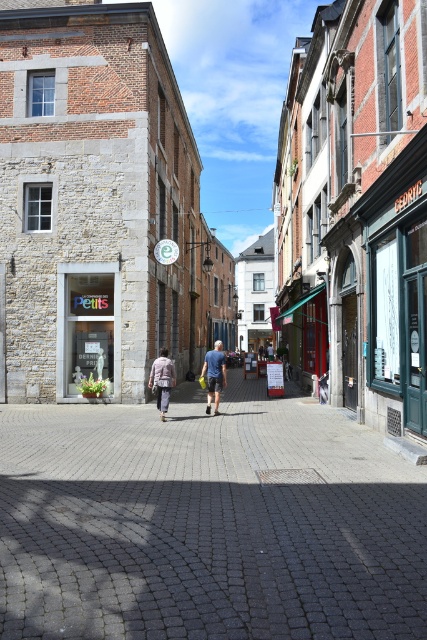
You are standing on a cobblestone street in a European town. You see a green fabric awning at center. Where exactly is the green fabric awning located in relation to the point marked at coordinates [307,336]?

The green fabric awning at center is located exactly at the point marked at coordinates [307,336].

You are a delivery person trying to place a box on the ground in this urban street scene. The box is 5 cm tall. You have two options to place it on either the gray cobblestone pavement at center or the matte glass storefront at center. Which surface can safely accommodate the box without it being unstable due to height differences?

The gray cobblestone pavement at center has a lesser height compared to the matte glass storefront at center, so placing the box on the gray cobblestone pavement at center would be safer as it is lower and more stable.

You are a delivery person standing at the entrance of the building on the left. You need to place a package at the green fabric awning at center and then deliver another package to the light brown fabric jacket at center. Given that your delivery cart is 1.2 meters wide, can you navigate the space between the two locations without moving the jacket?

The distance between the green fabric awning at center and the light brown fabric jacket at center is 11.45 meters. Since the cart is 1.2 meters wide, the cart can easily navigate the space between them as the distance is more than sufficient for movement.